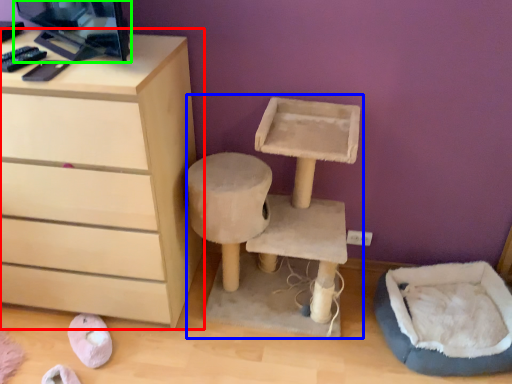
Question: Considering the real-world distances, which object is farthest from chest of drawers (highlighted by a red box)? computer desk (highlighted by a blue box) or desktop computer (highlighted by a green box)?

Choices:
 (A) computer desk
 (B) desktop computer

Answer: (A)